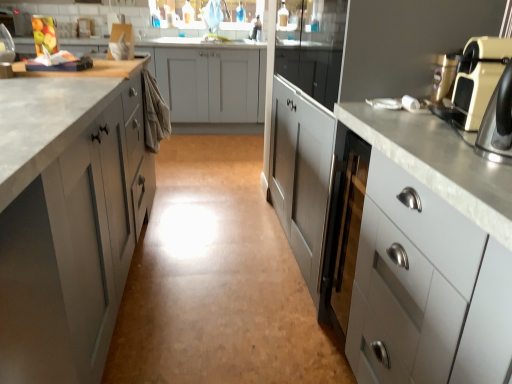
The height and width of the screenshot is (384, 512). What do you see at coordinates (478, 78) in the screenshot?
I see `beige plastic toaster at right` at bounding box center [478, 78].

This screenshot has width=512, height=384. What do you see at coordinates (68, 220) in the screenshot? I see `matte gray cabinet at left, the third cabinetry from the right` at bounding box center [68, 220].

Measure the distance between metallic gold coffee machine at upper right and camera.

metallic gold coffee machine at upper right is 3.64 feet from camera.

The image size is (512, 384). I want to click on beige plastic toaster at right, so [478, 78].

Can you confirm if matte silver faucet at upper center is positioned to the right of beige plastic toaster at right?

No.

Is matte silver faucet at upper center wider than beige plastic toaster at right?

→ Yes, matte silver faucet at upper center is wider than beige plastic toaster at right.

Is matte silver faucet at upper center in front of or behind beige plastic toaster at right in the image?

In the image, matte silver faucet at upper center appears behind beige plastic toaster at right.

Are matte gray cabinet at left, which is counted as the first cabinetry, starting from the left, and matte silver faucet at upper center beside each other?

matte gray cabinet at left, which is counted as the first cabinetry, starting from the left, and matte silver faucet at upper center are not in contact.

Is point (62, 352) closer to camera compared to point (222, 40)?

That is True.

Between matte gray cabinet at left, which is counted as the first cabinetry, starting from the left, and matte silver faucet at upper center, which one is positioned behind?

matte silver faucet at upper center is further from the camera.

I want to click on cabinetry on the left of matte silver faucet at upper center, so click(68, 220).

Would you say metallic gold coffee machine at upper right contains matte gray cabinet at left, the third cabinetry from the right?

No, matte gray cabinet at left, the third cabinetry from the right, is located outside of metallic gold coffee machine at upper right.

Which is more to the right, metallic gold coffee machine at upper right or matte gray cabinet at left, the third cabinetry from the right?

metallic gold coffee machine at upper right is more to the right.

Considering the positions of point (441, 89) and point (136, 196), is point (441, 89) closer or farther from the camera than point (136, 196)?

Point (441, 89).

Is metallic gold coffee machine at upper right looking in the opposite direction of matte gray cabinet at left, which is counted as the first cabinetry, starting from the left?

metallic gold coffee machine at upper right is not turned away from matte gray cabinet at left, which is counted as the first cabinetry, starting from the left.

Is matte gray cabinet at left, the third cabinetry from the right, far away from metallic gold coffee machine at upper right?

That's right, there is a large distance between matte gray cabinet at left, the third cabinetry from the right, and metallic gold coffee machine at upper right.

Which is more to the left, matte gray cabinet at left, the third cabinetry from the right, or metallic gold coffee machine at upper right?

matte gray cabinet at left, the third cabinetry from the right.

Is the depth of matte gray cabinet at left, which is counted as the first cabinetry, starting from the left, greater than that of metallic gold coffee machine at upper right?

No, the depth of matte gray cabinet at left, which is counted as the first cabinetry, starting from the left, is less than that of metallic gold coffee machine at upper right.

From a real-world perspective, is matte gray cabinet at left, the third cabinetry from the right, on top of metallic gold coffee machine at upper right?

Actually, matte gray cabinet at left, the third cabinetry from the right, is physically below metallic gold coffee machine at upper right in the real world.

Can you confirm if white glossy cabinet at right, which ranks as the 1th cabinetry in right-to-left order, is smaller than metallic gold coffee machine at upper right?

Incorrect, white glossy cabinet at right, which ranks as the 1th cabinetry in right-to-left order, is not smaller in size than metallic gold coffee machine at upper right.

Between white glossy cabinet at right, which ranks as the 1th cabinetry in right-to-left order, and metallic gold coffee machine at upper right, which one has larger width?

Wider between the two is white glossy cabinet at right, which ranks as the 1th cabinetry in right-to-left order.

Is point (418, 361) more distant than point (447, 54)?

No, (418, 361) is in front of (447, 54).

Considering the sizes of satin white cabinet at right, marked as the second cabinetry in a left-to-right arrangement, and matte silver faucet at upper center in the image, is satin white cabinet at right, marked as the second cabinetry in a left-to-right arrangement, wider or thinner than matte silver faucet at upper center?

Clearly, satin white cabinet at right, marked as the second cabinetry in a left-to-right arrangement, has more width compared to matte silver faucet at upper center.

Considering the relative sizes of satin white cabinet at right, the 2th cabinetry from the right, and matte silver faucet at upper center in the image provided, is satin white cabinet at right, the 2th cabinetry from the right, smaller than matte silver faucet at upper center?

Incorrect, satin white cabinet at right, the 2th cabinetry from the right, is not smaller in size than matte silver faucet at upper center.

Would you consider satin white cabinet at right, marked as the second cabinetry in a left-to-right arrangement, to be distant from matte silver faucet at upper center?

That's right, there is a large distance between satin white cabinet at right, marked as the second cabinetry in a left-to-right arrangement, and matte silver faucet at upper center.

Does beige plastic toaster at right have a lesser height compared to matte silver faucet at upper center?

Correct, beige plastic toaster at right is not as tall as matte silver faucet at upper center.

Is beige plastic toaster at right aimed at matte silver faucet at upper center?

No, beige plastic toaster at right is not aimed at matte silver faucet at upper center.

Are beige plastic toaster at right and matte silver faucet at upper center making contact?

beige plastic toaster at right and matte silver faucet at upper center are clearly separated.

What's the angular difference between beige plastic toaster at right and matte silver faucet at upper center's facing directions?

beige plastic toaster at right and matte silver faucet at upper center are facing 101 degrees away from each other.

The image size is (512, 384). I want to click on home appliance in front of the matte silver faucet at upper center, so click(478, 78).

Where is `the 2nd cabinetry located beneath the matte silver faucet at upper center (from a real-world perspective)`? the 2nd cabinetry located beneath the matte silver faucet at upper center (from a real-world perspective) is located at coordinates (68, 220).

Based on their spatial positions, is metallic gold coffee machine at upper right or matte silver faucet at upper center further from beige plastic toaster at right?

Based on the image, matte silver faucet at upper center appears to be further to beige plastic toaster at right.

From the image, which object appears to be nearer to white glossy cabinet at right, which ranks as the 1th cabinetry in right-to-left order, beige plastic toaster at right or satin white cabinet at right, the 2th cabinetry from the right?

satin white cabinet at right, the 2th cabinetry from the right, is positioned closer to the anchor white glossy cabinet at right, which ranks as the 1th cabinetry in right-to-left order.

Considering their positions, is metallic gold coffee machine at upper right positioned further to white glossy cabinet at right, which ranks as the third cabinetry in left-to-right order, than satin white cabinet at right, the 2th cabinetry from the right?

The object further to white glossy cabinet at right, which ranks as the third cabinetry in left-to-right order, is metallic gold coffee machine at upper right.

Considering their positions, is metallic gold coffee machine at upper right positioned further to beige plastic toaster at right than satin white cabinet at right, marked as the second cabinetry in a left-to-right arrangement?

Based on the image, satin white cabinet at right, marked as the second cabinetry in a left-to-right arrangement, appears to be further to beige plastic toaster at right.

From the picture: Considering their positions, is matte gray cabinet at left, which is counted as the first cabinetry, starting from the left, positioned closer to white glossy cabinet at right, which ranks as the 1th cabinetry in right-to-left order, than beige plastic toaster at right?

beige plastic toaster at right lies closer to white glossy cabinet at right, which ranks as the 1th cabinetry in right-to-left order, than the other object.

Looking at this image, considering their positions, is beige plastic toaster at right positioned closer to metallic gold coffee machine at upper right than satin white cabinet at right, the 2th cabinetry from the right?

beige plastic toaster at right lies closer to metallic gold coffee machine at upper right than the other object.

When comparing their distances from matte silver faucet at upper center, does white glossy cabinet at right, which ranks as the third cabinetry in left-to-right order, or matte gray cabinet at left, which is counted as the first cabinetry, starting from the left, seem further?

Based on the image, white glossy cabinet at right, which ranks as the third cabinetry in left-to-right order, appears to be further to matte silver faucet at upper center.

In the scene shown: Estimate the real-world distances between objects in this image. Which object is further from beige plastic toaster at right, matte gray cabinet at left, the third cabinetry from the right, or metallic gold coffee machine at upper right?

matte gray cabinet at left, the third cabinetry from the right, is positioned further to the anchor beige plastic toaster at right.

This screenshot has width=512, height=384. Identify the location of home appliance between matte gray cabinet at left, which is counted as the first cabinetry, starting from the left, and metallic gold coffee machine at upper right. (478, 78).

I want to click on coffee machine located between white glossy cabinet at right, which ranks as the 1th cabinetry in right-to-left order, and matte silver faucet at upper center in the depth direction, so click(444, 76).

The image size is (512, 384). Identify the location of cabinetry between beige plastic toaster at right and satin white cabinet at right, the 2th cabinetry from the right, from front to back. (426, 289).

Identify the location of coffee machine positioned between matte gray cabinet at left, the third cabinetry from the right, and matte silver faucet at upper center from near to far. Image resolution: width=512 pixels, height=384 pixels. (444, 76).